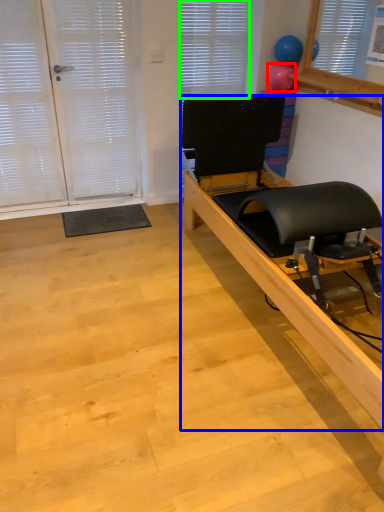
Question: Considering the real-world distances, which object is farthest from balloon (highlighted by a red box)? furniture (highlighted by a blue box) or blind (highlighted by a green box)?

Choices:
 (A) furniture
 (B) blind

Answer: (A)